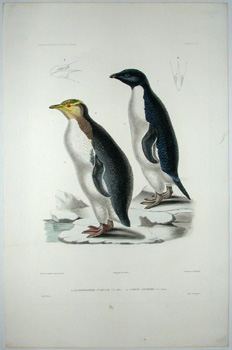
At what (x,y) coordinates should I click in order to perform the action: click on book. Please return your answer as a coordinate pair (x, y). Image resolution: width=232 pixels, height=350 pixels. Looking at the image, I should click on (111, 244).